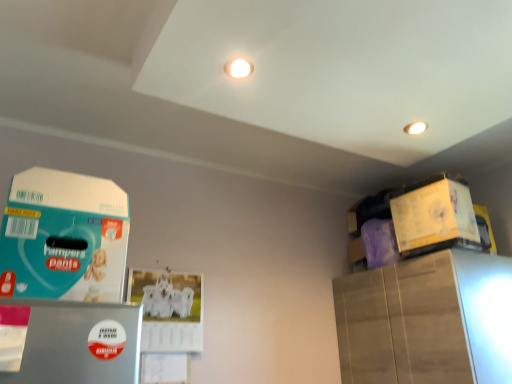
At what (x,y) coordinates should I click in order to perform the action: click on yellow cardboard box at upper right, which appears as the 2th box when viewed from the front. Please return your answer as a coordinate pair (x, y). Looking at the image, I should click on (435, 218).

This screenshot has width=512, height=384. Describe the element at coordinates (435, 218) in the screenshot. I see `yellow cardboard box at upper right, which is the second box from left to right` at that location.

The height and width of the screenshot is (384, 512). I want to click on teal matte paper at left, which is counted as the second box, starting from the right, so click(x=64, y=237).

What do you see at coordinates (64, 237) in the screenshot? I see `teal matte paper at left, which ranks as the 2th box in back-to-front order` at bounding box center [64, 237].

Measure the distance between point (11,204) and camera.

Point (11,204) and camera are 37.52 inches apart from each other.

Image resolution: width=512 pixels, height=384 pixels. In order to click on yellow cardboard box at upper right, which is the second box from left to right in this screenshot , I will do `click(435, 218)`.

Considering the relative positions of yellow cardboard box at upper right, positioned as the first box in back-to-front order, and teal matte paper at left, which ranks as the 2th box in back-to-front order, in the image provided, is yellow cardboard box at upper right, positioned as the first box in back-to-front order, to the right of teal matte paper at left, which ranks as the 2th box in back-to-front order, from the viewer's perspective?

Yes, yellow cardboard box at upper right, positioned as the first box in back-to-front order, is to the right of teal matte paper at left, which ranks as the 2th box in back-to-front order.

Is the position of yellow cardboard box at upper right, positioned as the first box in back-to-front order, more distant than that of teal matte paper at left, the 1th box from the left?

Yes, yellow cardboard box at upper right, positioned as the first box in back-to-front order, is further from the viewer.

Between point (434, 190) and point (93, 199), which one is positioned behind?

Point (434, 190)

Consider the image. From the image's perspective, between yellow cardboard box at upper right, which is counted as the 1th box, starting from the right, and teal matte paper at left, the 1th box from the left, which one is located above?

yellow cardboard box at upper right, which is counted as the 1th box, starting from the right, appears higher in the image.

From a real-world perspective, is yellow cardboard box at upper right, positioned as the first box in back-to-front order, above or below teal matte paper at left, the 1th box from the left?

In terms of real-world spatial position, yellow cardboard box at upper right, positioned as the first box in back-to-front order, is above teal matte paper at left, the 1th box from the left.

Can you confirm if yellow cardboard box at upper right, positioned as the first box in back-to-front order, is wider than teal matte paper at left, which ranks as the 2th box in back-to-front order?

No, yellow cardboard box at upper right, positioned as the first box in back-to-front order, is not wider than teal matte paper at left, which ranks as the 2th box in back-to-front order.

Who is taller, yellow cardboard box at upper right, which appears as the 2th box when viewed from the front, or teal matte paper at left, the 1th box from the left?

teal matte paper at left, the 1th box from the left, is taller.

Who is smaller, yellow cardboard box at upper right, which is counted as the 1th box, starting from the right, or teal matte paper at left, the 1th box from the left?

yellow cardboard box at upper right, which is counted as the 1th box, starting from the right.

Is yellow cardboard box at upper right, which is counted as the 1th box, starting from the right, surrounding teal matte paper at left, marked as the first box in a front-to-back arrangement?

No, teal matte paper at left, marked as the first box in a front-to-back arrangement, is not a part of yellow cardboard box at upper right, which is counted as the 1th box, starting from the right.

Based on the photo, would you say yellow cardboard box at upper right, which appears as the 2th box when viewed from the front, is a long distance from teal matte paper at left, marked as the first box in a front-to-back arrangement?

Yes, yellow cardboard box at upper right, which appears as the 2th box when viewed from the front, and teal matte paper at left, marked as the first box in a front-to-back arrangement, are quite far apart.

Could you tell me if yellow cardboard box at upper right, which is counted as the 1th box, starting from the right, is facing teal matte paper at left, which ranks as the 2th box in back-to-front order?

Yes, yellow cardboard box at upper right, which is counted as the 1th box, starting from the right, faces towards teal matte paper at left, which ranks as the 2th box in back-to-front order.

Based on the photo, how different are the orientations of yellow cardboard box at upper right, which appears as the 2th box when viewed from the front, and teal matte paper at left, the 1th box from the left, in degrees?

There is a 84-degree angle between the facing directions of yellow cardboard box at upper right, which appears as the 2th box when viewed from the front, and teal matte paper at left, the 1th box from the left.

You are a GUI agent. You are given a task and a screenshot of the screen. Output one action in this format:
    pyautogui.click(x=<x>, y=<y>)
    Task: Click on the box located on the left of yellow cardboard box at upper right, which is counted as the 1th box, starting from the right
    Image resolution: width=512 pixels, height=384 pixels.
    Given the screenshot: What is the action you would take?
    pyautogui.click(x=64, y=237)

Considering the relative positions of teal matte paper at left, which is counted as the second box, starting from the right, and yellow cardboard box at upper right, positioned as the first box in back-to-front order, in the image provided, is teal matte paper at left, which is counted as the second box, starting from the right, to the right of yellow cardboard box at upper right, positioned as the first box in back-to-front order, from the viewer's perspective?

In fact, teal matte paper at left, which is counted as the second box, starting from the right, is to the left of yellow cardboard box at upper right, positioned as the first box in back-to-front order.

Which object is more forward, teal matte paper at left, which ranks as the 2th box in back-to-front order, or yellow cardboard box at upper right, which is counted as the 1th box, starting from the right?

teal matte paper at left, which ranks as the 2th box in back-to-front order, is in front.

Is point (22, 217) closer to viewer compared to point (438, 188)?

Yes, it is in front of point (438, 188).

From the image's perspective, is teal matte paper at left, which is counted as the second box, starting from the right, above yellow cardboard box at upper right, which is the second box from left to right?

No, from the image's perspective, teal matte paper at left, which is counted as the second box, starting from the right, is not above yellow cardboard box at upper right, which is the second box from left to right.

From a real-world perspective, who is located higher, teal matte paper at left, which ranks as the 2th box in back-to-front order, or yellow cardboard box at upper right, which appears as the 2th box when viewed from the front?

From a 3D spatial view, yellow cardboard box at upper right, which appears as the 2th box when viewed from the front, is above.

Considering the sizes of objects teal matte paper at left, which ranks as the 2th box in back-to-front order, and yellow cardboard box at upper right, which is the second box from left to right, in the image provided, who is wider, teal matte paper at left, which ranks as the 2th box in back-to-front order, or yellow cardboard box at upper right, which is the second box from left to right,?

teal matte paper at left, which ranks as the 2th box in back-to-front order, is wider.

Is teal matte paper at left, marked as the first box in a front-to-back arrangement, taller than yellow cardboard box at upper right, which appears as the 2th box when viewed from the front?

Correct, teal matte paper at left, marked as the first box in a front-to-back arrangement, is much taller as yellow cardboard box at upper right, which appears as the 2th box when viewed from the front.

From the picture: Between teal matte paper at left, which is counted as the second box, starting from the right, and yellow cardboard box at upper right, which appears as the 2th box when viewed from the front, which one has smaller size?

yellow cardboard box at upper right, which appears as the 2th box when viewed from the front, is smaller.

Would you say teal matte paper at left, which is counted as the second box, starting from the right, is outside yellow cardboard box at upper right, which is the second box from left to right?

That's correct, teal matte paper at left, which is counted as the second box, starting from the right, is outside of yellow cardboard box at upper right, which is the second box from left to right.

Is teal matte paper at left, the 1th box from the left, not near yellow cardboard box at upper right, positioned as the first box in back-to-front order?

Yes, teal matte paper at left, the 1th box from the left, is far from yellow cardboard box at upper right, positioned as the first box in back-to-front order.

Is teal matte paper at left, the 1th box from the left, turned away from yellow cardboard box at upper right, which appears as the 2th box when viewed from the front?

No, teal matte paper at left, the 1th box from the left, is not facing away from yellow cardboard box at upper right, which appears as the 2th box when viewed from the front.

Can you tell me how much teal matte paper at left, which is counted as the second box, starting from the right, and yellow cardboard box at upper right, which is counted as the 1th box, starting from the right, differ in facing direction?

84 degrees.

The width and height of the screenshot is (512, 384). I want to click on box that is on the right side of teal matte paper at left, which ranks as the 2th box in back-to-front order, so [x=435, y=218].

The height and width of the screenshot is (384, 512). In order to click on box above the teal matte paper at left, the 1th box from the left (from a real-world perspective) in this screenshot , I will do `click(435, 218)`.

Identify the location of box below the yellow cardboard box at upper right, which is counted as the 1th box, starting from the right (from the image's perspective). (64, 237).